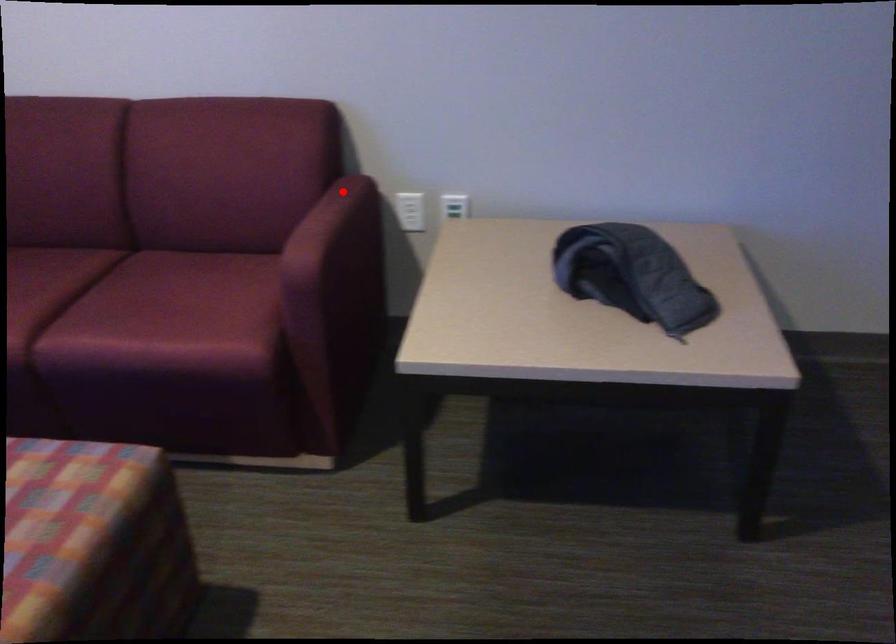
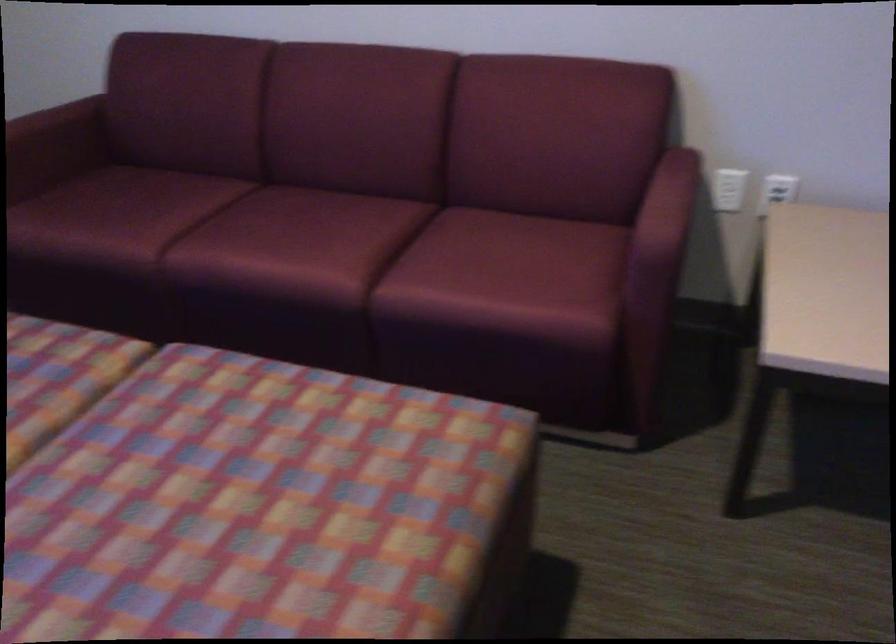
Find the pixel in the second image that matches the highlighted location in the first image.

(678, 166)